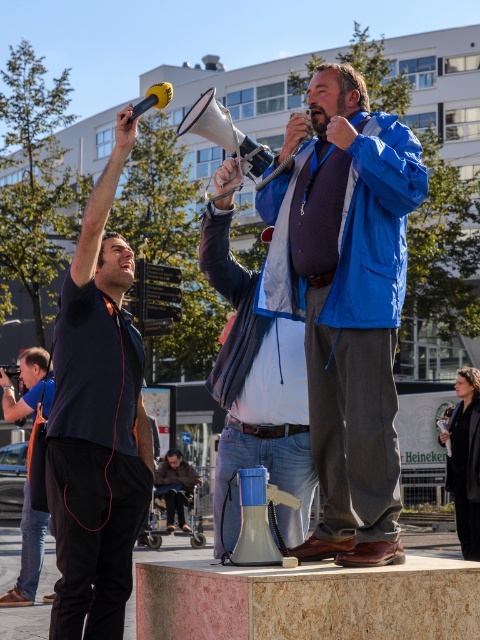
Is blue fabric jacket at center shorter than matte black camera at lower left?

No.

Does blue fabric jacket at center have a greater height compared to matte black camera at lower left?

Yes.

At what (x,y) coordinates should I click in order to perform the action: click on blue fabric jacket at center. Please return your answer as a coordinate pair (x, y). Image resolution: width=480 pixels, height=640 pixels. Looking at the image, I should click on (346, 301).

Is blue fabric jacket at center thinner than black matte shirt at left?

No, blue fabric jacket at center is not thinner than black matte shirt at left.

Who is lower down, blue fabric jacket at center or black matte shirt at left?

blue fabric jacket at center is lower down.

Locate an element on the screen. This screenshot has width=480, height=640. blue fabric jacket at center is located at coordinates (346, 301).

Between point (108, 348) and point (29, 387), which one is positioned behind?

Positioned behind is point (29, 387).

Does point (99, 628) come farther from viewer compared to point (48, 358)?

No, (99, 628) is closer to viewer.

Image resolution: width=480 pixels, height=640 pixels. What do you see at coordinates (96, 422) in the screenshot? I see `black matte shirt at left` at bounding box center [96, 422].

The height and width of the screenshot is (640, 480). What are the coordinates of `black matte shirt at left` in the screenshot? It's located at (96, 422).